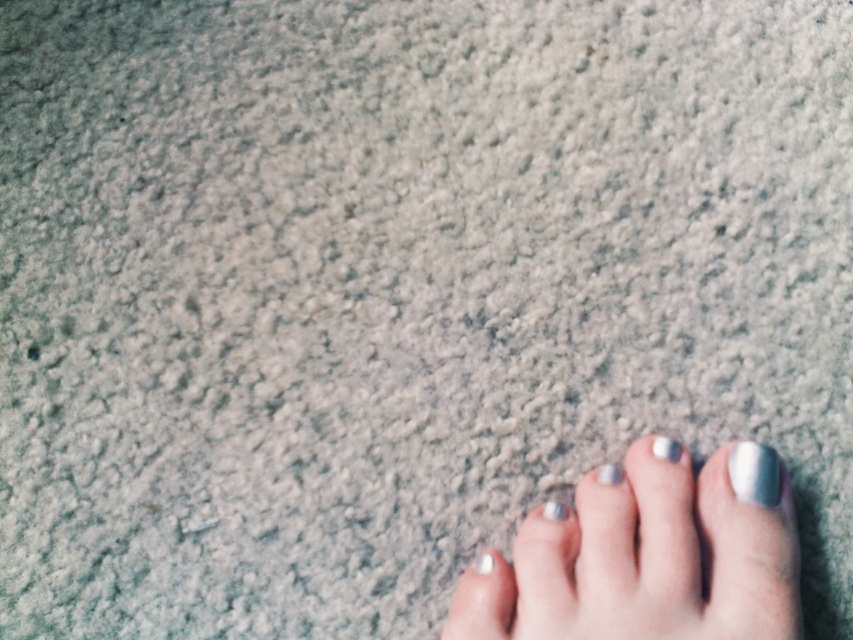
Is point (550, 508) more distant than point (619, 467)?

No, (550, 508) is closer to viewer.

Who is more forward, (549, 504) or (602, 480)?

Point (602, 480)

Find the location of a particular element. The height and width of the screenshot is (640, 853). silver metallic toe at center is located at coordinates (554, 509).

Does silver metallic toe at center lie behind silver metallic toe at lower right?

Yes, silver metallic toe at center is further from the viewer.

Is silver metallic toe at center above silver metallic toe at lower right?

Indeed, silver metallic toe at center is positioned over silver metallic toe at lower right.

Find the location of a particular element. silver metallic toe at center is located at coordinates (554, 509).

Who is taller, white glossy nail at lower right or silver metallic toe at lower right?

white glossy nail at lower right is taller.

What do you see at coordinates (753, 474) in the screenshot? The height and width of the screenshot is (640, 853). I see `white glossy nail at lower right` at bounding box center [753, 474].

I want to click on white glossy nail at lower right, so click(x=753, y=474).